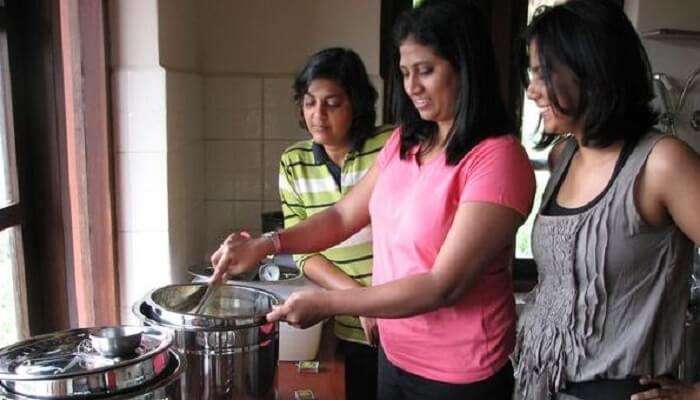
Identify the location of white tiles. (245, 113), (237, 175), (272, 115), (270, 150).